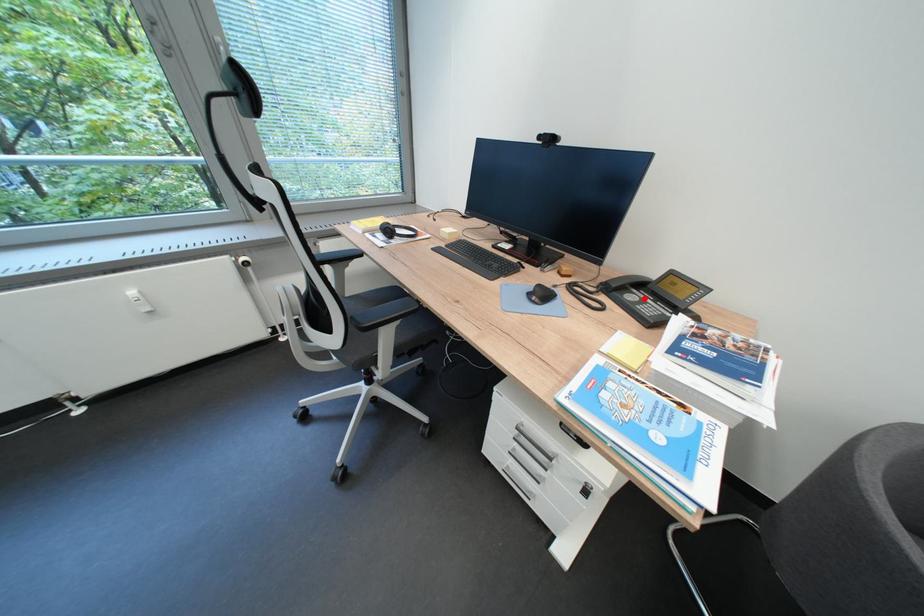
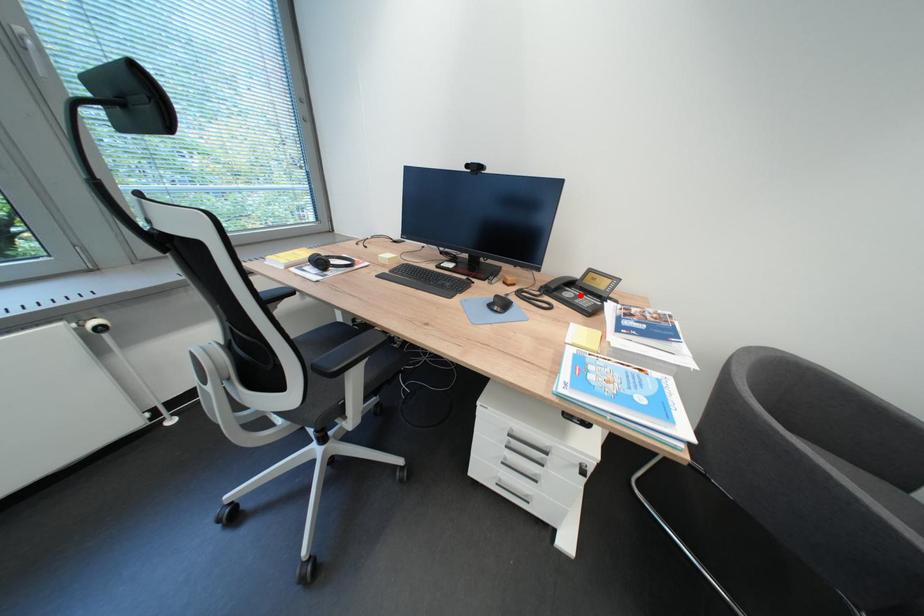
I am providing you with two images of the same scene from different viewpoints. A red point is marked on the first image and another point is marked on the second image. Is the marked point in image1 the same physical position as the marked point in image2?

Yes